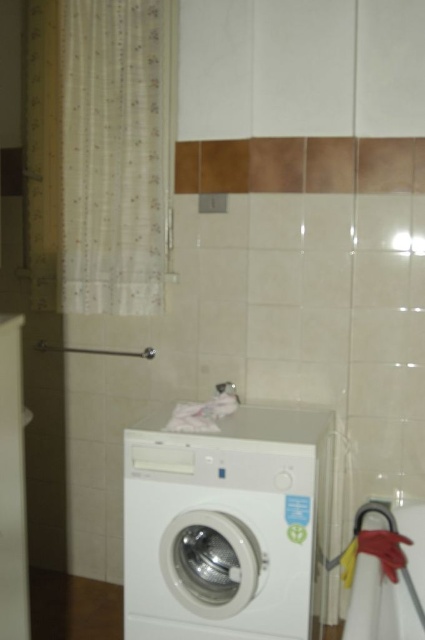
You are standing in the bathroom and want to reach the point at coordinates (249,406). The washing machine is in front of you. Is the point closer to you than the washing machine?

The point at coordinates (249,406) is 7.53 feet away from the camera. Since the washing machine is between you and the point, the point is farther away than the washing machine.

You need to place a new laundry basket that is 1.2 meters wide between the white glossy washing machine at center and the translucent fabric curtain at left. Based on the scene description, will the laundry basket fit in the space between them?

The white glossy washing machine at center is wider than the translucent fabric curtain at left. However, the exact distance between them isn not specified in the scene description. Therefore, it is uncertain if the laundry basket will fit without additional measurements.

You are organizing the bathroom and want to hang a new curtain to the right of the white glossy washing machine at center. Is there space between the washing machine and the translucent fabric curtain at left to place it?

The white glossy washing machine at center is to the right of the translucent fabric curtain at left, so there is space between them. You can place the new curtain to the right of the washing machine at center.